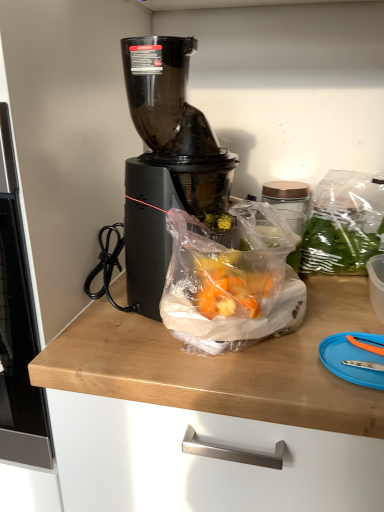
Question: Considering the relative positions of black plastic blender at center and blue plastic cutting board at lower right in the image provided, is black plastic blender at center to the left of blue plastic cutting board at lower right from the viewer's perspective?

Choices:
 (A) yes
 (B) no

Answer: (A)

Question: Is blue plastic cutting board at lower right at the back of black plastic blender at center?

Choices:
 (A) yes
 (B) no

Answer: (B)

Question: Is the depth of black plastic blender at center greater than that of blue plastic cutting board at lower right?

Choices:
 (A) yes
 (B) no

Answer: (A)

Question: Can you confirm if black plastic blender at center is wider than blue plastic cutting board at lower right?

Choices:
 (A) yes
 (B) no

Answer: (A)

Question: From the image's perspective, is black plastic blender at center located above blue plastic cutting board at lower right?

Choices:
 (A) yes
 (B) no

Answer: (A)

Question: Based on their positions, is black plastic blender at center located to the left or right of blue plastic cutting board at lower right?

Choices:
 (A) left
 (B) right

Answer: (A)

Question: Looking at the image, does black plastic blender at center seem bigger or smaller compared to blue plastic cutting board at lower right?

Choices:
 (A) small
 (B) big

Answer: (B)

Question: From the image's perspective, relative to blue plastic cutting board at lower right, is black plastic blender at center above or below?

Choices:
 (A) below
 (B) above

Answer: (B)

Question: Is black plastic blender at center taller or shorter than blue plastic cutting board at lower right?

Choices:
 (A) short
 (B) tall

Answer: (B)

Question: Considering the positions of point (322, 343) and point (296, 312), is point (322, 343) closer or farther from the camera than point (296, 312)?

Choices:
 (A) closer
 (B) farther

Answer: (A)

Question: From a real-world perspective, relative to translucent plastic bag at center, is blue plastic cutting board at lower right vertically above or below?

Choices:
 (A) below
 (B) above

Answer: (A)

Question: Looking at their shapes, would you say blue plastic cutting board at lower right is wider or thinner than translucent plastic bag at center?

Choices:
 (A) wide
 (B) thin

Answer: (B)

Question: From the image's perspective, is blue plastic cutting board at lower right positioned above or below translucent plastic bag at center?

Choices:
 (A) below
 (B) above

Answer: (A)

Question: Would you say blue plastic cutting board at lower right is inside or outside black plastic blender at center?

Choices:
 (A) inside
 (B) outside

Answer: (B)

Question: Would you say blue plastic cutting board at lower right is to the left or to the right of black plastic blender at center in the picture?

Choices:
 (A) right
 (B) left

Answer: (A)